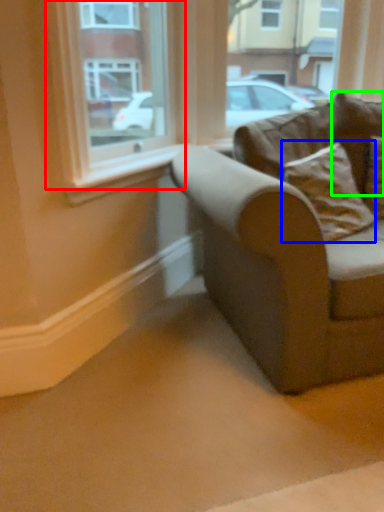
Question: Estimate the real-world distances between objects in this image. Which object is farther from window (highlighted by a red box), pillow (highlighted by a blue box) or pillow (highlighted by a green box)?

Choices:
 (A) pillow
 (B) pillow

Answer: (A)